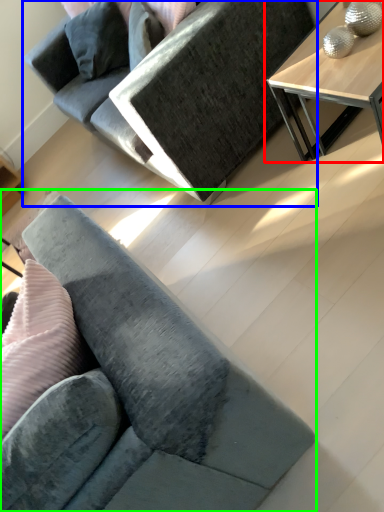
Question: Considering the real-world distances, which object is closest to table (highlighted by a red box)? studio couch (highlighted by a blue box) or studio couch (highlighted by a green box).

Choices:
 (A) studio couch
 (B) studio couch

Answer: (A)